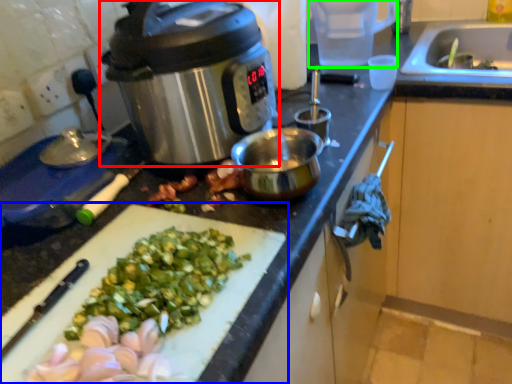
Question: Considering the real-world distances, which object is farthest from slow cooker (highlighted by a red box)? cutting board (highlighted by a blue box) or appliance (highlighted by a green box)?

Choices:
 (A) cutting board
 (B) appliance

Answer: (B)